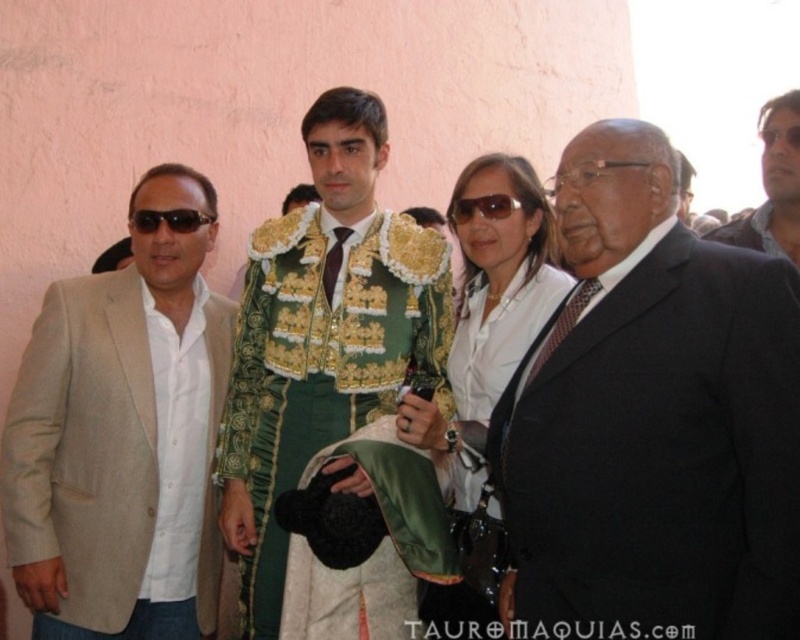
Identify the location of green satin jacket at center. The width and height of the screenshot is (800, 640). (328, 339).

Looking at this image, does green satin jacket at center have a greater height compared to matte black sunglasses at center?

Yes, green satin jacket at center is taller than matte black sunglasses at center.

Does point (276, 472) come farther from viewer compared to point (480, 196)?

No, (276, 472) is closer to viewer.

The height and width of the screenshot is (640, 800). I want to click on green satin jacket at center, so click(x=328, y=339).

Between green satin jacket at center and white satin blouse at center, which one appears on the right side from the viewer's perspective?

From the viewer's perspective, white satin blouse at center appears more on the right side.

Does point (306, 282) come closer to viewer compared to point (532, 202)?

That is True.

Measure the distance between green satin jacket at center and camera.

green satin jacket at center is 51.92 feet away from camera.

The image size is (800, 640). In order to click on green satin jacket at center in this screenshot , I will do `click(328, 339)`.

Who is more distant from viewer, (796, 353) or (384, 154)?

The point (384, 154) is behind.

Does black satin suit at center appear under green satin jacket at center?

Correct, black satin suit at center is located below green satin jacket at center.

Between point (725, 556) and point (238, 548), which one is positioned in front?

Point (725, 556) is in front.

Locate an element on the screen. This screenshot has height=640, width=800. black satin suit at center is located at coordinates (652, 419).